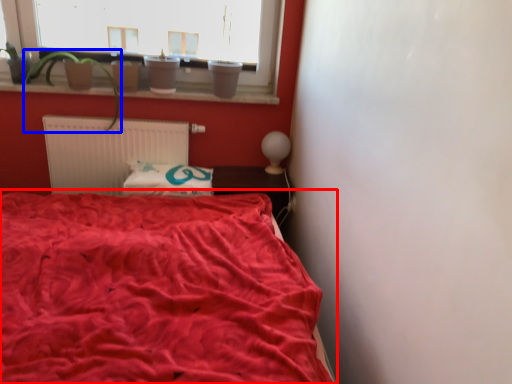
Question: Which object is further to the camera taking this photo, bed (highlighted by a red box) or plant (highlighted by a blue box)?

Choices:
 (A) bed
 (B) plant

Answer: (B)